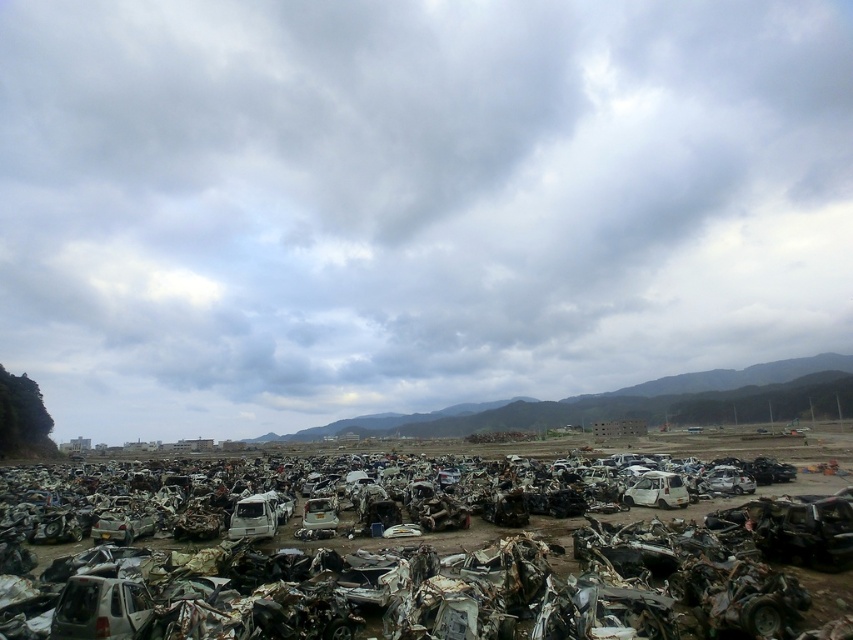
You are standing at the point marked as point (506, 580) in the image. What object is located at that point?

The point (506, 580) corresponds to the rusty metal car at lower left.

You are a worker in the junkyard who needs to move a 5.5 meter long crane arm from the rusty metal car at lower left to the white matte car at lower left. Can the crane arm be placed between them without bending or cutting it?

The distance between the rusty metal car at lower left and the white matte car at lower left is 6.01 meters. Since the crane arm is 5.5 meters long, it can be placed between them without bending or cutting it as the distance is sufficient.